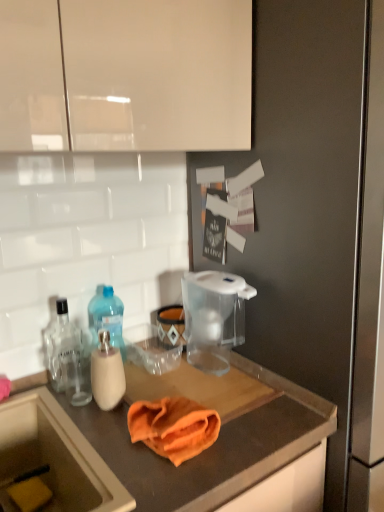
Question: Is orange microfiber cloth at center at the right side of yellow sponge at lower left?

Choices:
 (A) no
 (B) yes

Answer: (B)

Question: From the image's perspective, would you say orange microfiber cloth at center is shown under yellow sponge at lower left?

Choices:
 (A) yes
 (B) no

Answer: (B)

Question: Can you confirm if orange microfiber cloth at center is positioned to the left of yellow sponge at lower left?

Choices:
 (A) no
 (B) yes

Answer: (A)

Question: Is orange microfiber cloth at center wider than yellow sponge at lower left?

Choices:
 (A) yes
 (B) no

Answer: (A)

Question: Is orange microfiber cloth at center touching yellow sponge at lower left?

Choices:
 (A) no
 (B) yes

Answer: (A)

Question: Is translucent plastic bottle at left, the 1th bottle positioned from the right, wider or thinner than clear glass bottle at left, which is the 2th bottle from right to left?

Choices:
 (A) thin
 (B) wide

Answer: (B)

Question: In terms of size, does translucent plastic bottle at left, the 1th bottle positioned from the right, appear bigger or smaller than clear glass bottle at left, which is the 2th bottle from right to left?

Choices:
 (A) small
 (B) big

Answer: (B)

Question: Is translucent plastic bottle at left, which is the second bottle in left-to-right order, inside the boundaries of clear glass bottle at left, which is the 2th bottle from right to left, or outside?

Choices:
 (A) outside
 (B) inside

Answer: (A)

Question: Is translucent plastic bottle at left, which is the second bottle in left-to-right order, taller or shorter than clear glass bottle at left, which is the 2th bottle from right to left?

Choices:
 (A) tall
 (B) short

Answer: (A)

Question: Choose the correct answer: Is transparent plastic pitcher at upper center inside transparent plastic water filter pitcher at center or outside it?

Choices:
 (A) outside
 (B) inside

Answer: (A)

Question: Is transparent plastic pitcher at upper center in front of or behind transparent plastic water filter pitcher at center in the image?

Choices:
 (A) behind
 (B) front

Answer: (B)

Question: Is transparent plastic pitcher at upper center bigger or smaller than transparent plastic water filter pitcher at center?

Choices:
 (A) small
 (B) big

Answer: (B)

Question: Looking at their shapes, would you say transparent plastic pitcher at upper center is wider or thinner than transparent plastic water filter pitcher at center?

Choices:
 (A) thin
 (B) wide

Answer: (B)

Question: From the image's perspective, is orange fabric at center above or below translucent plastic bottle at left, which is the second bottle in left-to-right order?

Choices:
 (A) above
 (B) below

Answer: (B)

Question: Based on their positions, is orange fabric at center located to the left or right of translucent plastic bottle at left, which is the second bottle in left-to-right order?

Choices:
 (A) left
 (B) right

Answer: (B)